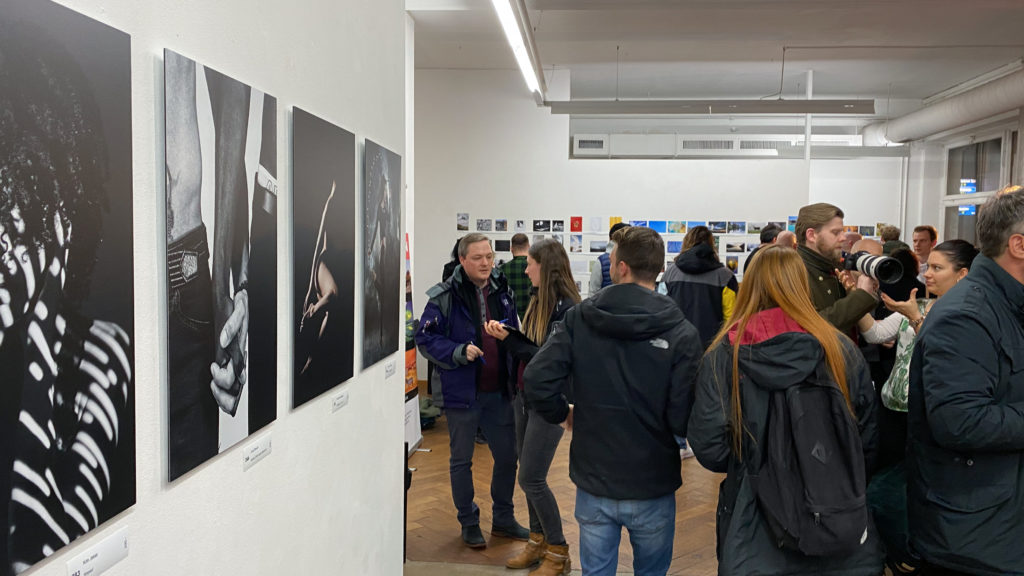
Locate an element on the screen. The height and width of the screenshot is (576, 1024). photos on back wall is located at coordinates (496, 227), (556, 227), (667, 231), (731, 231).